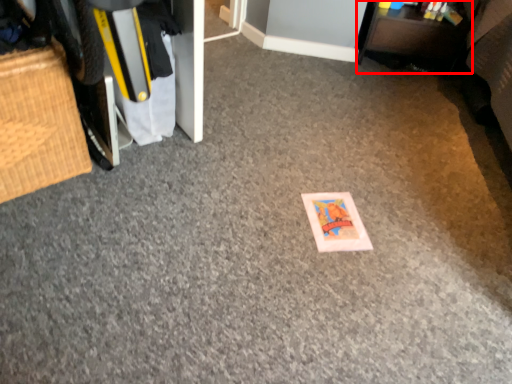
Question: In this image, where is furniture (annotated by the red box) located relative to furniture?

Choices:
 (A) right
 (B) left

Answer: (A)